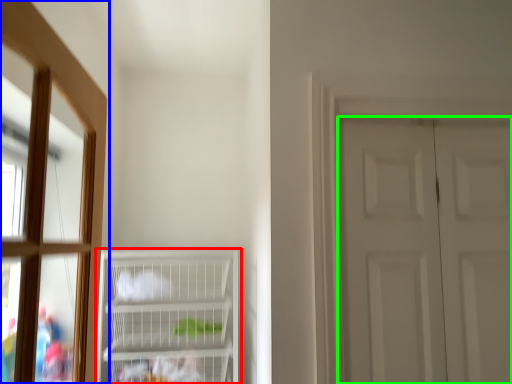
Question: Considering the real-world distances, which object is farthest from cupboard (highlighted by a red box)? window (highlighted by a blue box) or door (highlighted by a green box)?

Choices:
 (A) window
 (B) door

Answer: (B)